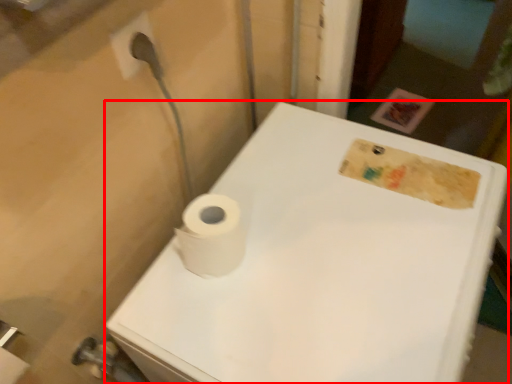
Question: Observing the image, what is the correct spatial positioning of porcelain (annotated by the red box) in reference to toilet paper?

Choices:
 (A) left
 (B) right

Answer: (B)